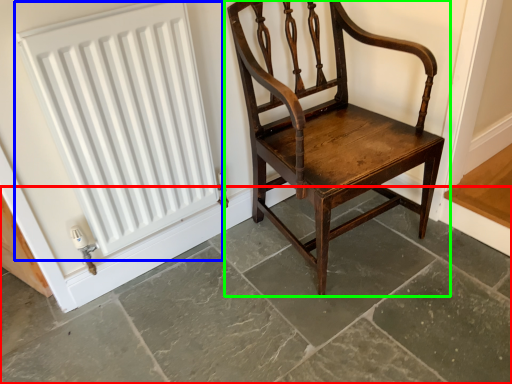
Question: Considering the real-world distances, which object is farthest from concrete (highlighted by a red box)? radiator (highlighted by a blue box) or chair (highlighted by a green box)?

Choices:
 (A) radiator
 (B) chair

Answer: (A)